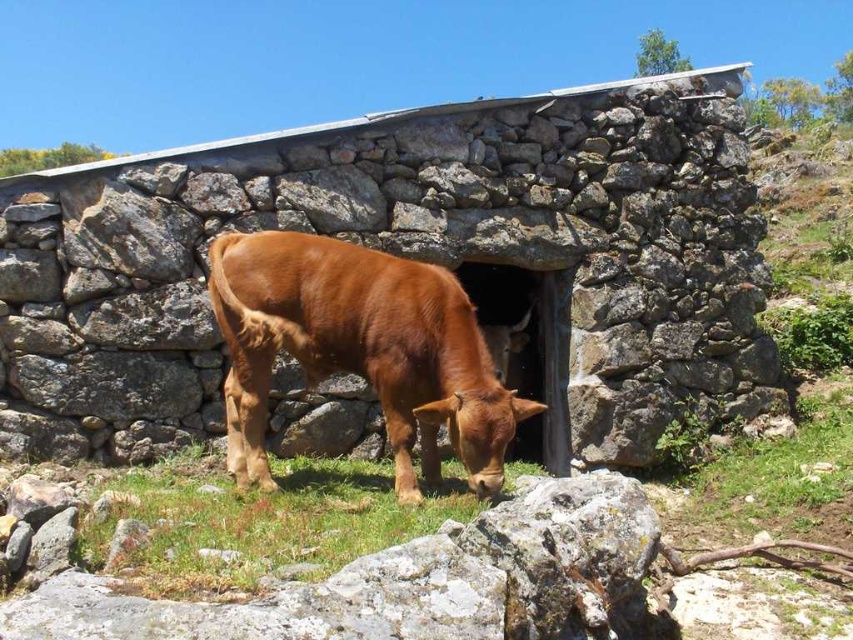
The height and width of the screenshot is (640, 853). What do you see at coordinates (358, 349) in the screenshot?
I see `brown matte cow at center` at bounding box center [358, 349].

Can you confirm if brown matte cow at center is bigger than green grass at lower center?

Indeed, brown matte cow at center has a larger size compared to green grass at lower center.

Locate an element on the screen. brown matte cow at center is located at coordinates (358, 349).